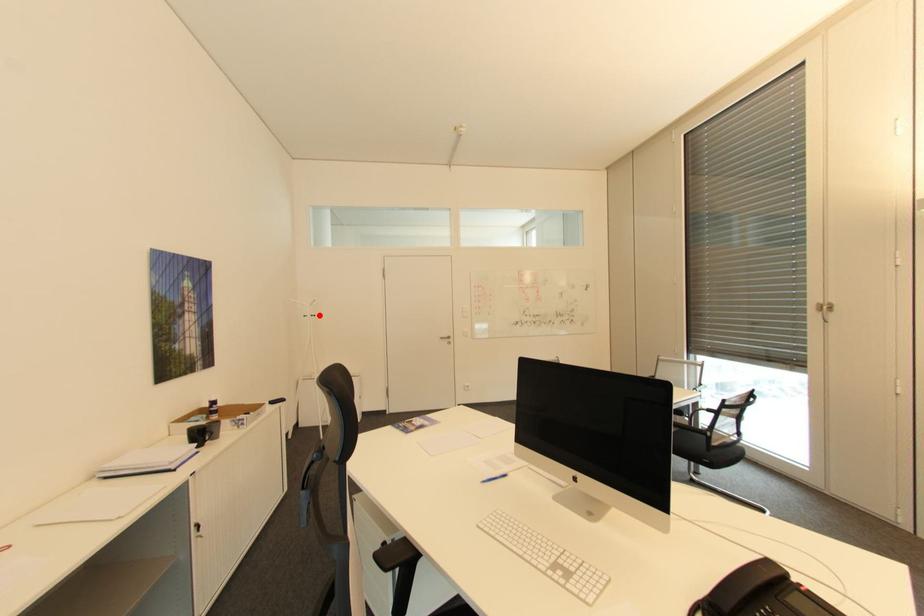
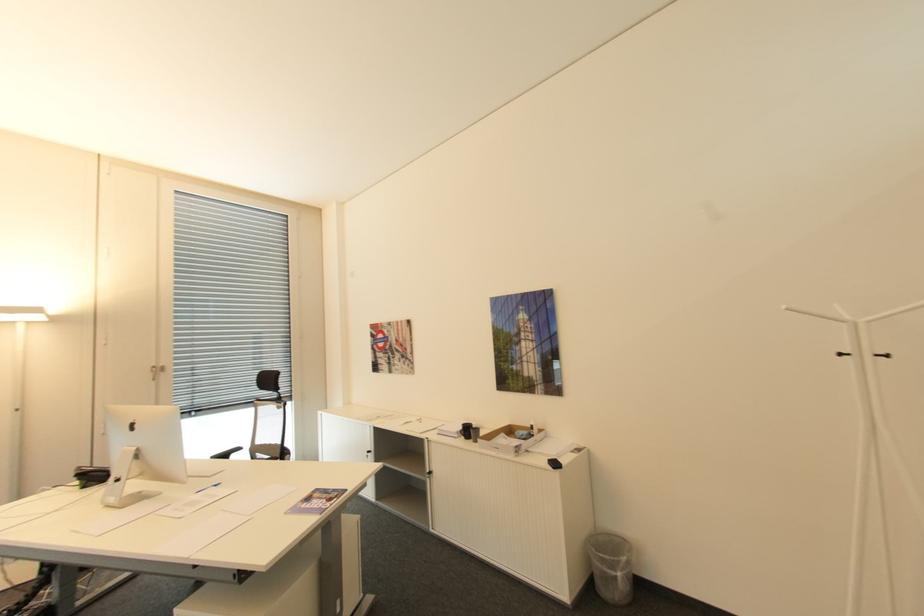
Question: I am providing you with two images of the same scene from different viewpoints. A red point is marked on the first image. Is the red point's position out of view in image 2?

Choices:
 (A) Yes
 (B) No

Answer: (B)